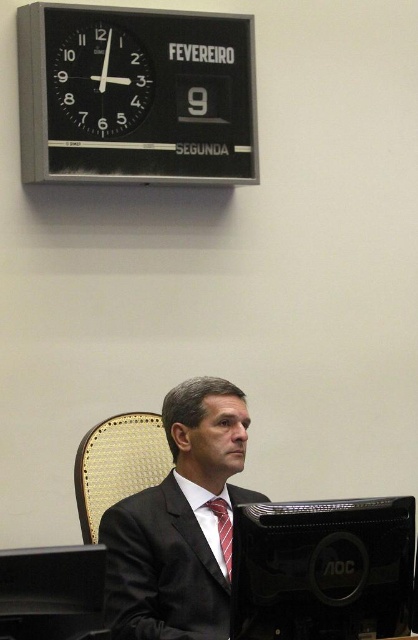
How distant is black plastic clock at upper center from red silk tie at center?

The distance of black plastic clock at upper center from red silk tie at center is 1.64 meters.

In the scene shown: Is black plastic clock at upper center taller than red silk tie at center?

Yes, black plastic clock at upper center is taller than red silk tie at center.

Is point (53, 10) positioned behind point (213, 502)?

Yes, it is.

The image size is (418, 640). What are the coordinates of `black plastic clock at upper center` in the screenshot? It's located at (135, 96).

Is black plastic clock at upper center shorter than woven fabric chair at center?

No.

Which is above, black plastic clock at upper center or woven fabric chair at center?

black plastic clock at upper center is above.

Is point (41, 147) farther from camera compared to point (81, 449)?

That is True.

The width and height of the screenshot is (418, 640). Find the location of `black plastic clock at upper center`. black plastic clock at upper center is located at coordinates (135, 96).

Between black plastic clock at upper left and red silk tie at center, which one is positioned higher?

black plastic clock at upper left is higher up.

Does point (71, 60) come closer to viewer compared to point (226, 513)?

No, it is behind (226, 513).

At what (x,y) coordinates should I click in order to perform the action: click on black plastic clock at upper left. Please return your answer as a coordinate pair (x, y). This screenshot has width=418, height=640. Looking at the image, I should click on (101, 81).